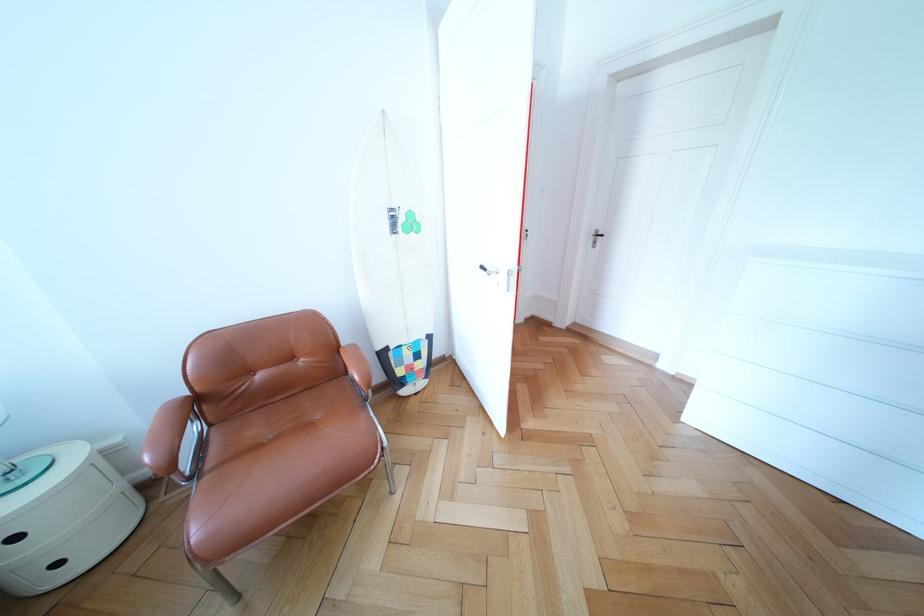
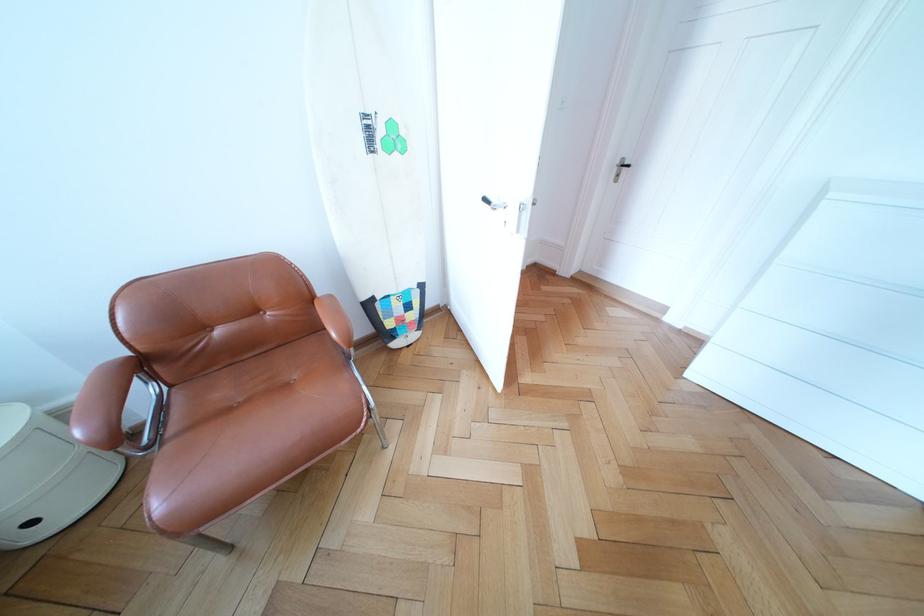
In the second image, find the point that corresponds to (322,430) in the first image.

(298, 391)